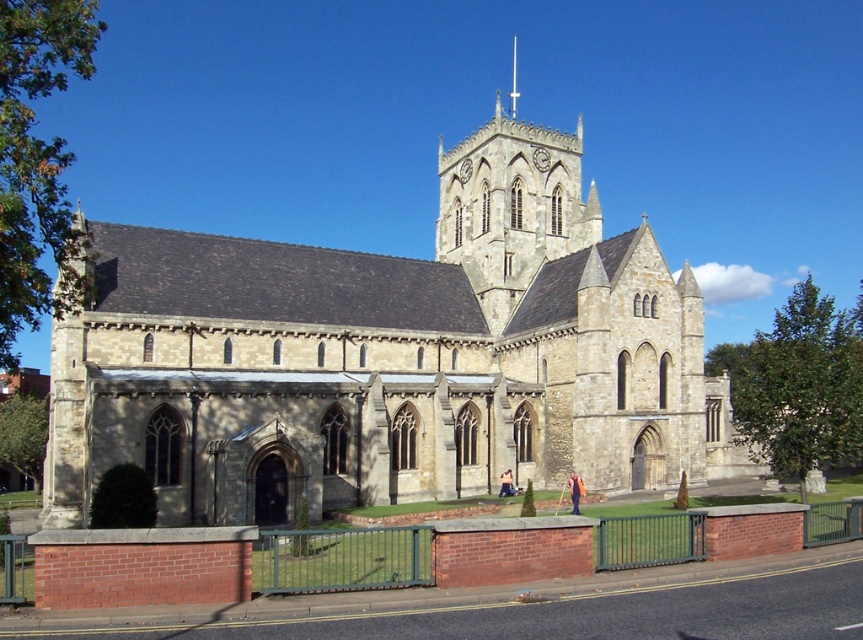
Question: Which point appears farthest from the camera in this image?

Choices:
 (A) (275, 458)
 (B) (515, 99)

Answer: (B)

Question: Is stone church at center positioned at the back of smooth stone spire at center?

Choices:
 (A) no
 (B) yes

Answer: (A)

Question: Is stone church at center to the right of smooth stone spire at center from the viewer's perspective?

Choices:
 (A) yes
 (B) no

Answer: (B)

Question: Can you confirm if stone church at center is wider than smooth stone spire at center?

Choices:
 (A) yes
 (B) no

Answer: (A)